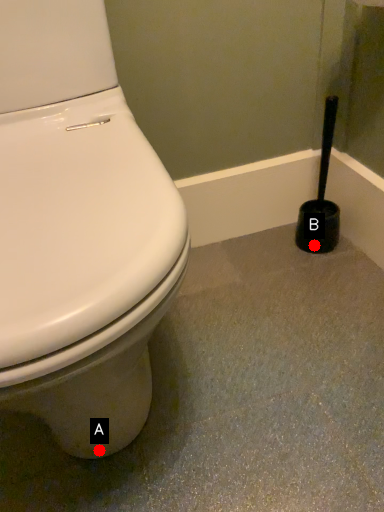
Question: Two points are circled on the image, labeled by A and B beside each circle. Which point is closer to the camera?

Choices:
 (A) A is closer
 (B) B is closer

Answer: (A)